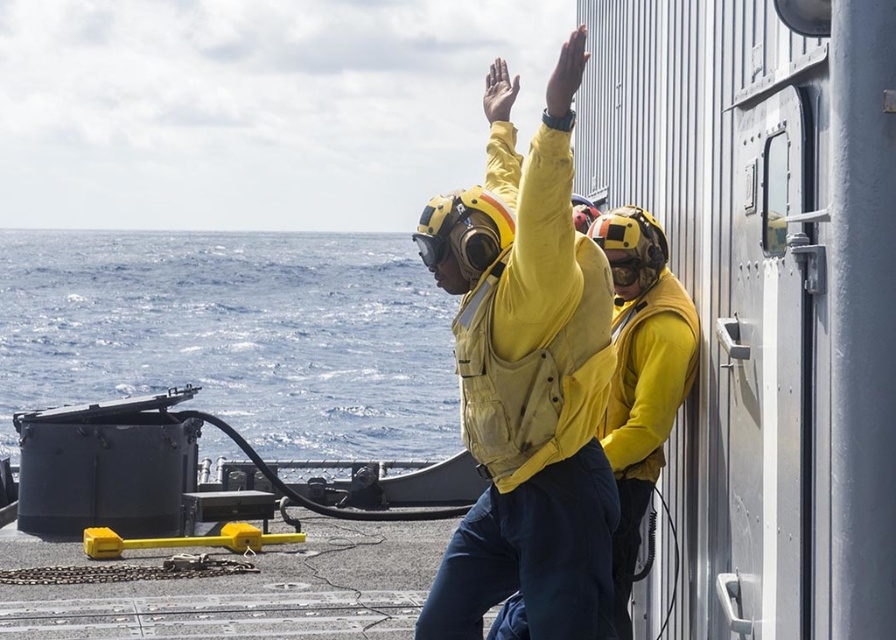
Question: Is blue water at left below yellow matte life vest at center?

Choices:
 (A) yes
 (B) no

Answer: (B)

Question: Is blue water at left positioned before yellow matte life vest at center?

Choices:
 (A) yes
 (B) no

Answer: (B)

Question: Which point is farther from the camera taking this photo?

Choices:
 (A) (85, 260)
 (B) (593, 328)

Answer: (A)

Question: Among these objects, which one is farthest from the camera?

Choices:
 (A) blue water at left
 (B) yellow matte life vest at center

Answer: (A)

Question: Is the position of blue water at left more distant than that of yellow matte life vest at center?

Choices:
 (A) yes
 (B) no

Answer: (A)